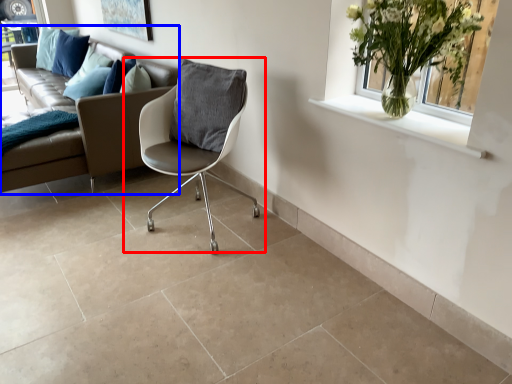
Question: Which of the following is the closest to the observer, chair (highlighted by a red box) or studio couch (highlighted by a blue box)?

Choices:
 (A) chair
 (B) studio couch

Answer: (A)